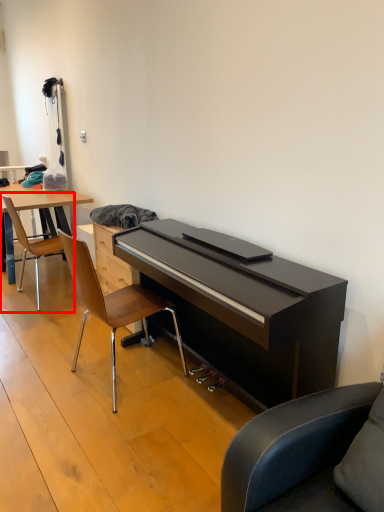
Question: From the image's perspective, considering the relative positions of chair (annotated by the red box) and chair in the image provided, where is chair (annotated by the red box) located with respect to the staircase?

Choices:
 (A) above
 (B) below

Answer: (A)